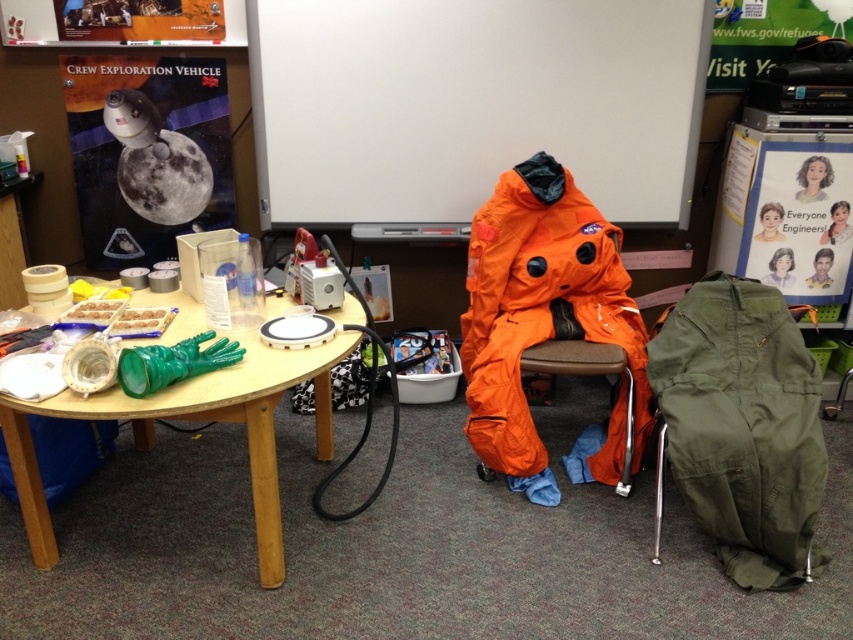
Question: Which of these objects is positioned closest to the matte paper poster at upper right?

Choices:
 (A) matte plastic poster at upper left
 (B) olive green fabric at lower right
 (C) woodenobject at lower center

Answer: (B)

Question: Is olive green fabric at lower right closer to the viewer compared to woodenobject at lower center?

Choices:
 (A) yes
 (B) no

Answer: (B)

Question: Does matte plastic poster at upper left lie behind matte paper poster at upper right?

Choices:
 (A) yes
 (B) no

Answer: (A)

Question: Can you confirm if orange fabric at center is smaller than matte plastic poster at upper left?

Choices:
 (A) no
 (B) yes

Answer: (A)

Question: Which point appears closest to the camera in this image?

Choices:
 (A) (564, 97)
 (B) (90, 257)

Answer: (A)

Question: Considering the real-world distances, which object is farthest from the matte plastic poster at upper left?

Choices:
 (A) matte paper poster at upper right
 (B) olive green fabric at lower right
 (C) orange fabric at center
 (D) woodenobject at lower center

Answer: (A)